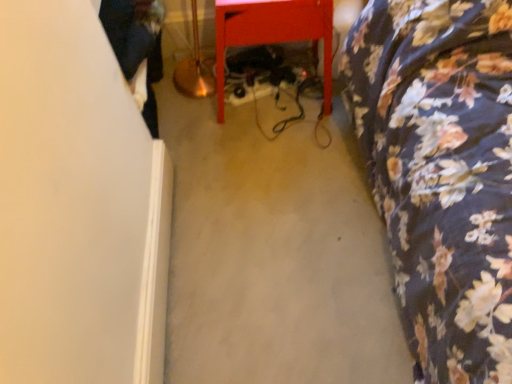
Question: Is dark blue jeans at left closer to camera compared to matte red table at center, acting as the first furniture starting from the left?

Choices:
 (A) yes
 (B) no

Answer: (B)

Question: Can you confirm if dark blue jeans at left is shorter than matte red table at center, acting as the first furniture starting from the left?

Choices:
 (A) yes
 (B) no

Answer: (A)

Question: From the image's perspective, is dark blue jeans at left below matte red table at center, which ranks as the second furniture in right-to-left order?

Choices:
 (A) yes
 (B) no

Answer: (B)

Question: Considering the relative positions of dark blue jeans at left and matte red table at center, which ranks as the second furniture in right-to-left order, in the image provided, is dark blue jeans at left to the left of matte red table at center, which ranks as the second furniture in right-to-left order, from the viewer's perspective?

Choices:
 (A) yes
 (B) no

Answer: (A)

Question: From a real-world perspective, does dark blue jeans at left sit lower than matte red table at center, acting as the first furniture starting from the left?

Choices:
 (A) no
 (B) yes

Answer: (B)

Question: From a real-world perspective, is matte red table at center, which ranks as the second furniture in right-to-left order, positioned above or below floral fabric bedspread at right, the 1th furniture when ordered from right to left?

Choices:
 (A) below
 (B) above

Answer: (A)

Question: From their relative heights in the image, would you say matte red table at center, which ranks as the second furniture in right-to-left order, is taller or shorter than floral fabric bedspread at right, the 1th furniture when ordered from right to left?

Choices:
 (A) tall
 (B) short

Answer: (B)

Question: From the image's perspective, relative to floral fabric bedspread at right, the 1th furniture when ordered from right to left, is matte red table at center, which ranks as the second furniture in right-to-left order, above or below?

Choices:
 (A) above
 (B) below

Answer: (A)

Question: In terms of width, does matte red table at center, which ranks as the second furniture in right-to-left order, look wider or thinner when compared to floral fabric bedspread at right, placed as the 2th furniture when sorted from left to right?

Choices:
 (A) thin
 (B) wide

Answer: (A)

Question: In the image, is dark blue jeans at left positioned in front of or behind matte red table at center, acting as the first furniture starting from the left?

Choices:
 (A) behind
 (B) front

Answer: (A)

Question: Does point (130, 36) appear closer or farther from the camera than point (305, 23)?

Choices:
 (A) closer
 (B) farther

Answer: (A)

Question: Is dark blue jeans at left wider or thinner than matte red table at center, acting as the first furniture starting from the left?

Choices:
 (A) thin
 (B) wide

Answer: (A)

Question: From the image's perspective, is dark blue jeans at left positioned above or below matte red table at center, acting as the first furniture starting from the left?

Choices:
 (A) above
 (B) below

Answer: (A)

Question: Do you think dark blue jeans at left is within floral fabric bedspread at right, placed as the 2th furniture when sorted from left to right, or outside of it?

Choices:
 (A) outside
 (B) inside

Answer: (A)

Question: Visually, is dark blue jeans at left positioned to the left or to the right of floral fabric bedspread at right, the 1th furniture when ordered from right to left?

Choices:
 (A) left
 (B) right

Answer: (A)